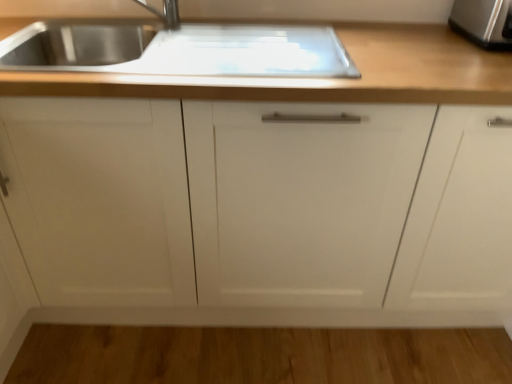
Question: Considering the relative sizes of white matte cabinet at center and stainless steel toaster at upper right in the image provided, is white matte cabinet at center shorter than stainless steel toaster at upper right?

Choices:
 (A) yes
 (B) no

Answer: (B)

Question: Does white matte cabinet at center have a lesser width compared to stainless steel toaster at upper right?

Choices:
 (A) yes
 (B) no

Answer: (B)

Question: Does white matte cabinet at center appear on the left side of stainless steel toaster at upper right?

Choices:
 (A) no
 (B) yes

Answer: (B)

Question: From the image's perspective, would you say white matte cabinet at center is positioned over stainless steel toaster at upper right?

Choices:
 (A) no
 (B) yes

Answer: (A)

Question: Does white matte cabinet at center lie in front of stainless steel toaster at upper right?

Choices:
 (A) no
 (B) yes

Answer: (B)

Question: Considering the relative sizes of white matte cabinet at center and stainless steel toaster at upper right in the image provided, is white matte cabinet at center taller than stainless steel toaster at upper right?

Choices:
 (A) yes
 (B) no

Answer: (A)

Question: Is white matte cabinet at center turned away from wooden countertop at upper center?

Choices:
 (A) yes
 (B) no

Answer: (A)

Question: Does white matte cabinet at center contain wooden countertop at upper center?

Choices:
 (A) no
 (B) yes

Answer: (B)

Question: Can we say white matte cabinet at center lies outside wooden countertop at upper center?

Choices:
 (A) no
 (B) yes

Answer: (B)

Question: Is white matte cabinet at center smaller than wooden countertop at upper center?

Choices:
 (A) yes
 (B) no

Answer: (B)

Question: Is white matte cabinet at center thinner than wooden countertop at upper center?

Choices:
 (A) no
 (B) yes

Answer: (A)

Question: Is white matte cabinet at center shorter than wooden countertop at upper center?

Choices:
 (A) no
 (B) yes

Answer: (A)

Question: Considering the relative sizes of stainless steel toaster at upper right and wooden countertop at upper center in the image provided, is stainless steel toaster at upper right wider than wooden countertop at upper center?

Choices:
 (A) yes
 (B) no

Answer: (B)